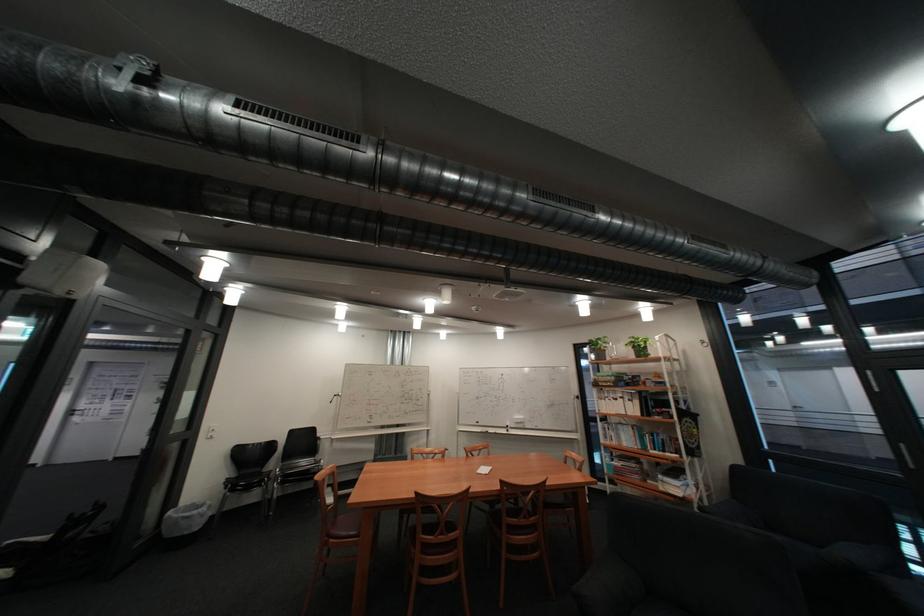
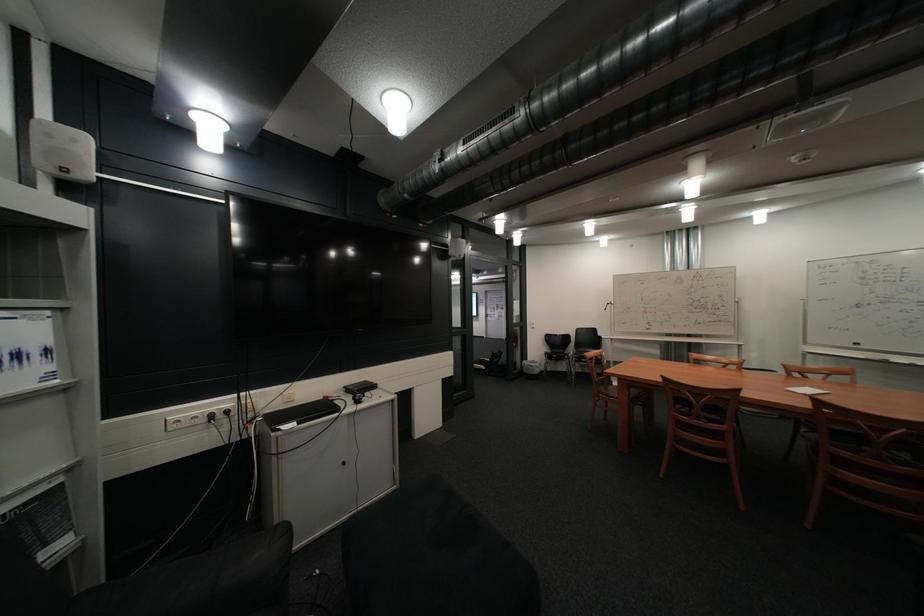
In the second image, find the point that corresponds to point 346,541 in the first image.

(615, 395)